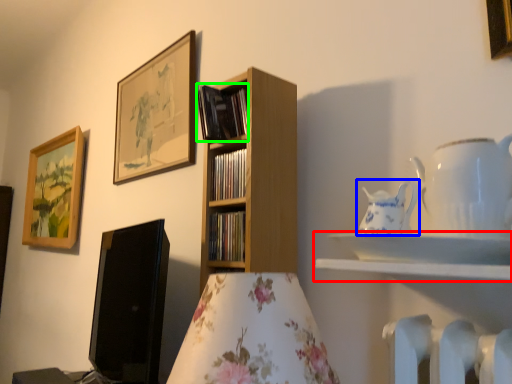
Question: Which object is positioned closest to shelf (highlighted by a red box)? Select from tableware (highlighted by a blue box) and book (highlighted by a green box).

Choices:
 (A) tableware
 (B) book

Answer: (A)